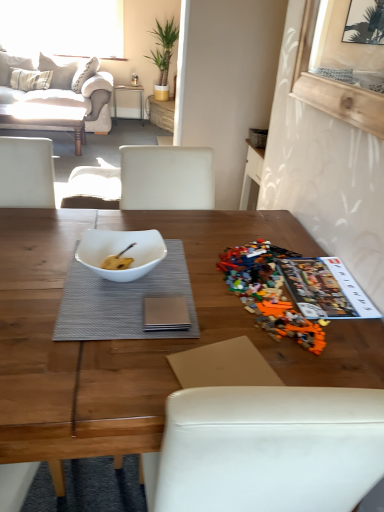
Question: Does white glossy bowl at center turn towards plaid fabric pillow at upper left, which ranks as the second pillow in right-to-left order?

Choices:
 (A) yes
 (B) no

Answer: (B)

Question: Does white glossy bowl at center come in front of plaid fabric pillow at upper left, the 1th pillow viewed from the left?

Choices:
 (A) yes
 (B) no

Answer: (A)

Question: From a real-world perspective, is white glossy bowl at center positioned over plaid fabric pillow at upper left, which ranks as the second pillow in right-to-left order, based on gravity?

Choices:
 (A) yes
 (B) no

Answer: (A)

Question: Would you say plaid fabric pillow at upper left, the 1th pillow viewed from the left, is part of white glossy bowl at center's contents?

Choices:
 (A) no
 (B) yes

Answer: (A)

Question: Considering the relative sizes of white glossy bowl at center and plaid fabric pillow at upper left, the 1th pillow viewed from the left, in the image provided, is white glossy bowl at center shorter than plaid fabric pillow at upper left, the 1th pillow viewed from the left,?

Choices:
 (A) yes
 (B) no

Answer: (A)

Question: Does white glossy bowl at center appear on the right side of plaid fabric pillow at upper left, which ranks as the second pillow in right-to-left order?

Choices:
 (A) no
 (B) yes

Answer: (B)

Question: From the image's perspective, is white glossy bowl at center on top of white paper magazine at right?

Choices:
 (A) yes
 (B) no

Answer: (A)

Question: From a real-world perspective, is white glossy bowl at center on white paper magazine at right?

Choices:
 (A) no
 (B) yes

Answer: (B)

Question: Can you confirm if white glossy bowl at center is bigger than white paper magazine at right?

Choices:
 (A) no
 (B) yes

Answer: (B)

Question: Does white glossy bowl at center touch white paper magazine at right?

Choices:
 (A) yes
 (B) no

Answer: (B)

Question: From a real-world perspective, is white glossy bowl at center positioned under white paper magazine at right based on gravity?

Choices:
 (A) no
 (B) yes

Answer: (A)

Question: From the image's perspective, does white glossy bowl at center appear lower than white paper magazine at right?

Choices:
 (A) no
 (B) yes

Answer: (A)

Question: Can you confirm if matte white coffee table at upper left, which is the first coffee table in back-to-front order, is smaller than white glossy bowl at center?

Choices:
 (A) no
 (B) yes

Answer: (A)